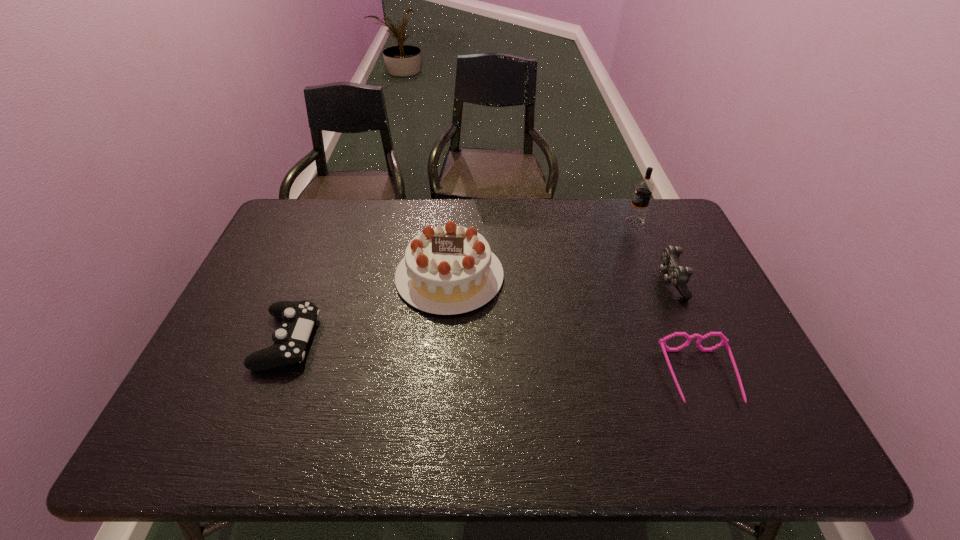
Locate an element on the screen. The height and width of the screenshot is (540, 960). the farthest object is located at coordinates (643, 190).

Find the location of `the tallest object`. the tallest object is located at coordinates (643, 190).

In order to click on birthday cake in this screenshot , I will do `click(450, 269)`.

This screenshot has width=960, height=540. I want to click on the fourth shortest object, so click(x=450, y=269).

You are a GUI agent. You are given a task and a screenshot of the screen. Output one action in this format:
    pyautogui.click(x=<x>, y=<y>)
    Task: Click on the taller control
    
    Given the screenshot: What is the action you would take?
    pyautogui.click(x=675, y=273)

This screenshot has height=540, width=960. In order to click on the farther control in this screenshot , I will do `click(675, 273)`.

Locate an element on the screen. the nearer control is located at coordinates (298, 317).

In order to click on the shorter control in this screenshot , I will do `click(298, 317)`.

The width and height of the screenshot is (960, 540). I want to click on spectacles, so click(x=724, y=340).

Identify the location of vacant area situated on the label of the tallest object. (538, 221).